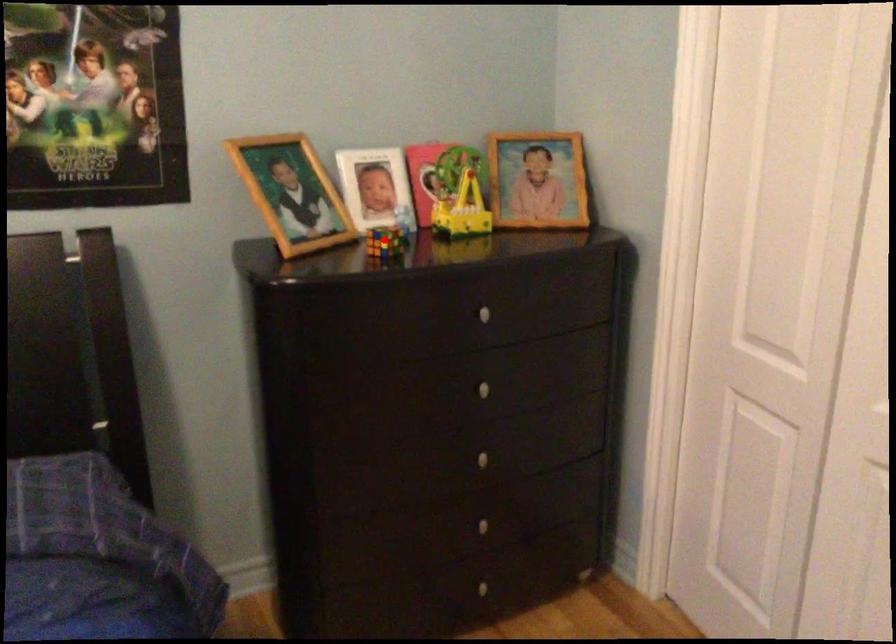
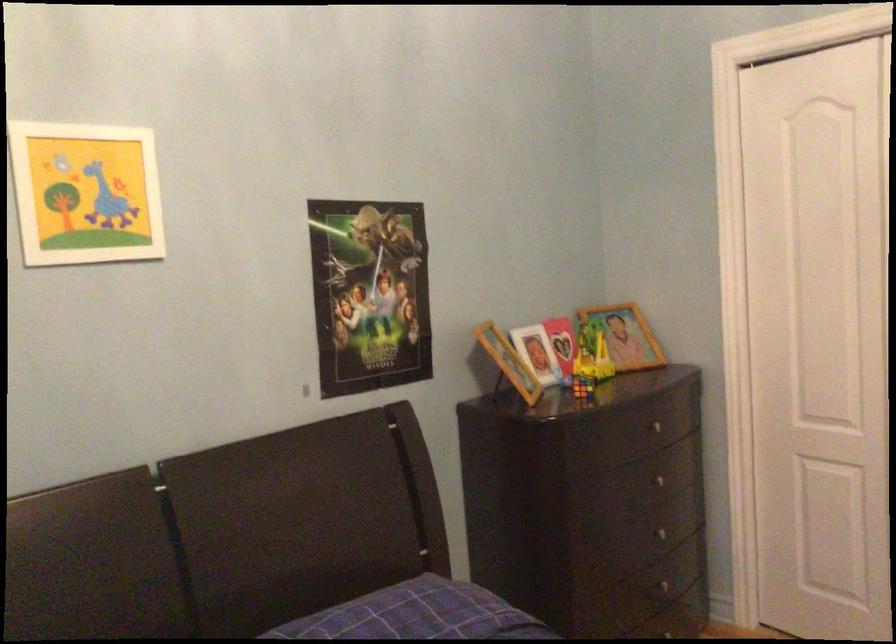
In the second image, find the point that corresponds to the highlighted location in the first image.

(582, 386)